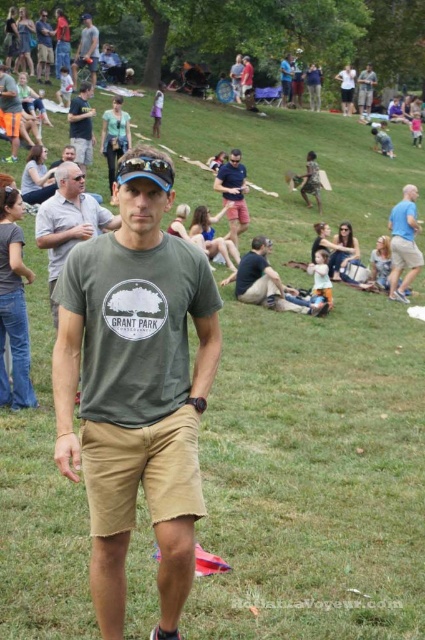
This screenshot has width=425, height=640. What do you see at coordinates (68, 221) in the screenshot? I see `green cotton t-shirt at center` at bounding box center [68, 221].

Does green cotton t-shirt at center lie behind blue cotton shirt at right?

No, green cotton t-shirt at center is closer to the viewer.

Does point (45, 204) come closer to viewer compared to point (396, 214)?

Yes, point (45, 204) is closer to viewer.

Where is `green cotton t-shirt at center`? green cotton t-shirt at center is located at coordinates (68, 221).

Who is shorter, green cotton t-shirt at center or matte green t-shirt at center?

green cotton t-shirt at center is shorter.

Is point (104, 230) farther from viewer compared to point (82, 90)?

No, (104, 230) is closer to viewer.

Where is `green cotton t-shirt at center`? Image resolution: width=425 pixels, height=640 pixels. green cotton t-shirt at center is located at coordinates (68, 221).

Is green cotton t-shirt at center wider than dark green t-shirt at center?

No, green cotton t-shirt at center is not wider than dark green t-shirt at center.

Is green cotton t-shirt at center to the right of dark green t-shirt at center from the viewer's perspective?

In fact, green cotton t-shirt at center is to the left of dark green t-shirt at center.

The height and width of the screenshot is (640, 425). I want to click on green cotton t-shirt at center, so click(68, 221).